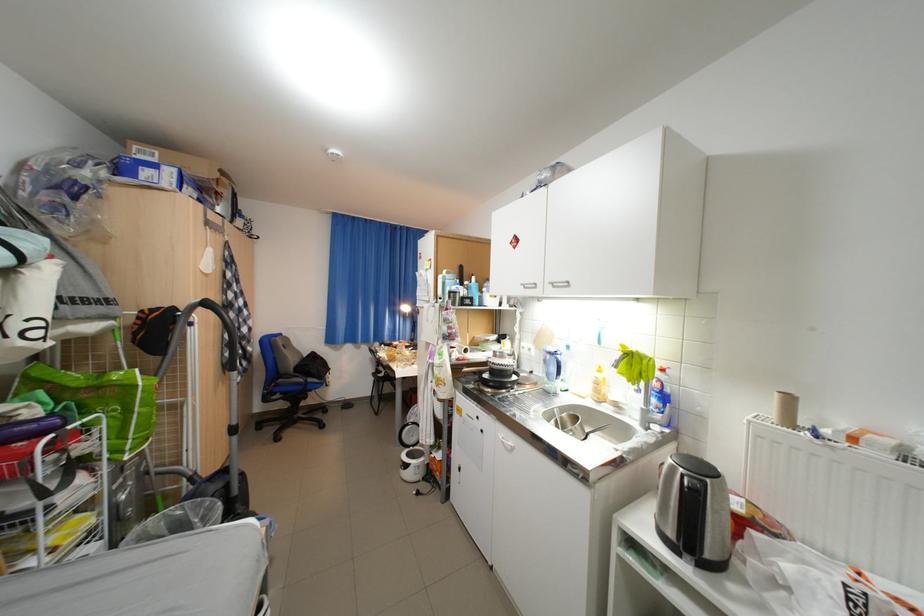
The height and width of the screenshot is (616, 924). Identify the location of pot handle. (694, 512).